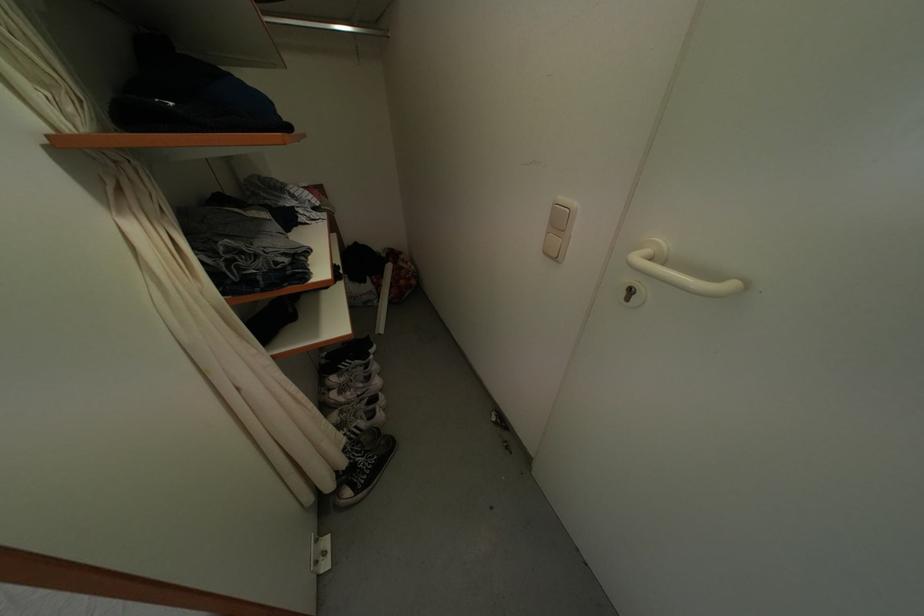
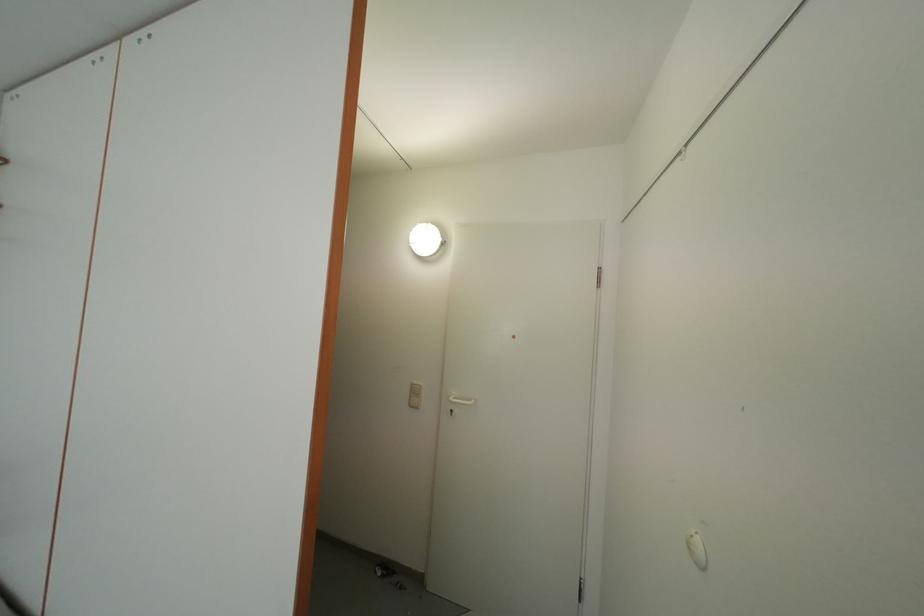
How did the camera likely rotate?

The rotation direction of the camera is right-up.